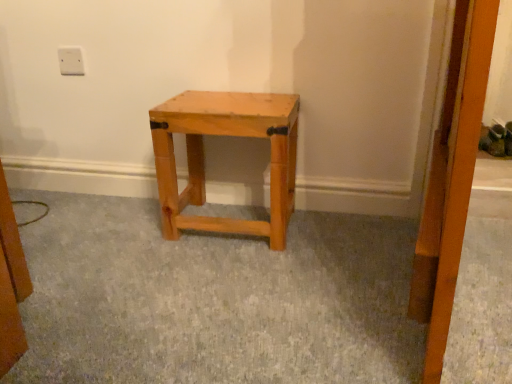
In order to click on vacant space to the right of natural wood stool at center in this screenshot , I will do `click(345, 231)`.